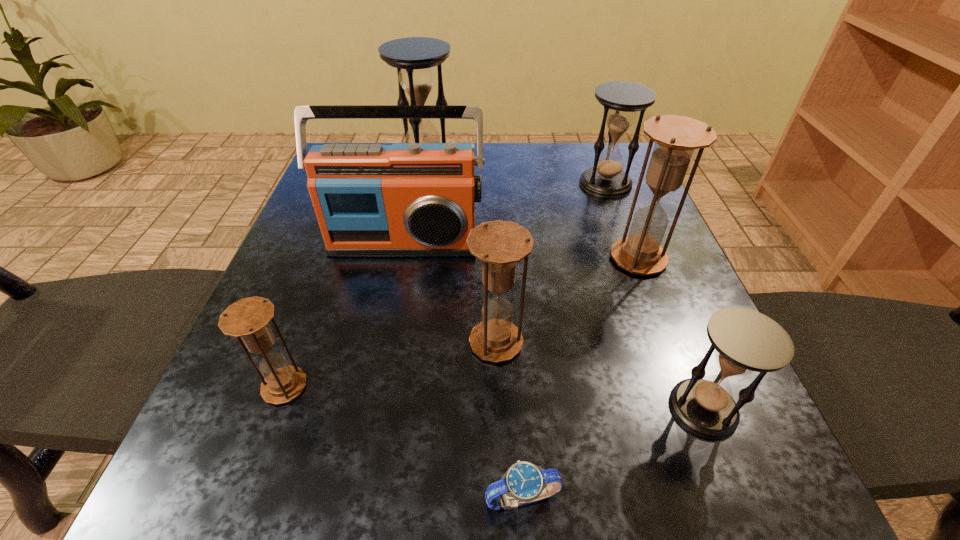
Locate an element on the screen. Image resolution: width=960 pixels, height=540 pixels. the nearest black hourglass is located at coordinates (744, 340).

This screenshot has width=960, height=540. I want to click on the nearest object, so click(522, 484).

Identify the location of the shortest object. This screenshot has width=960, height=540. (522, 484).

This screenshot has height=540, width=960. What are the coordinates of `vacant space located on the right of the second hourglass from left to right` in the screenshot? It's located at (612, 161).

Locate an element on the screen. The height and width of the screenshot is (540, 960). vacant space located on the front of the farthest brown hourglass is located at coordinates (701, 417).

Identify the location of vacant region located on the front-facing side of the blue radio receiver. (387, 329).

Locate an element on the screen. The image size is (960, 540). blank area located on the front of the second smallest black hourglass is located at coordinates (645, 289).

This screenshot has width=960, height=540. Find the location of `vacant space located 0.350m on the back of the second smallest brown hourglass`. vacant space located 0.350m on the back of the second smallest brown hourglass is located at coordinates (492, 202).

This screenshot has height=540, width=960. Identify the location of vacant region located on the right of the leftmost brown hourglass. (395, 387).

Find the location of a particular element. The height and width of the screenshot is (540, 960). vacant region located on the back of the smallest black hourglass is located at coordinates (638, 246).